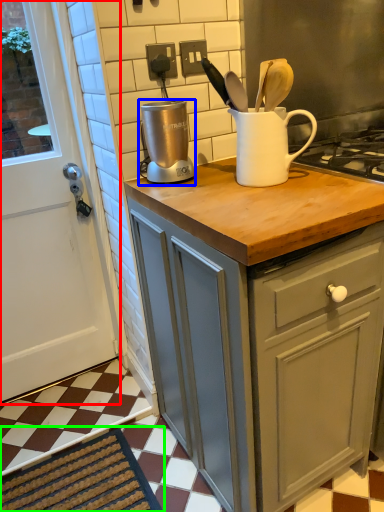
Question: Which is nearer to the door (highlighted by a red box)? kitchen appliance (highlighted by a blue box) or doormat (highlighted by a green box).

Choices:
 (A) kitchen appliance
 (B) doormat

Answer: (B)